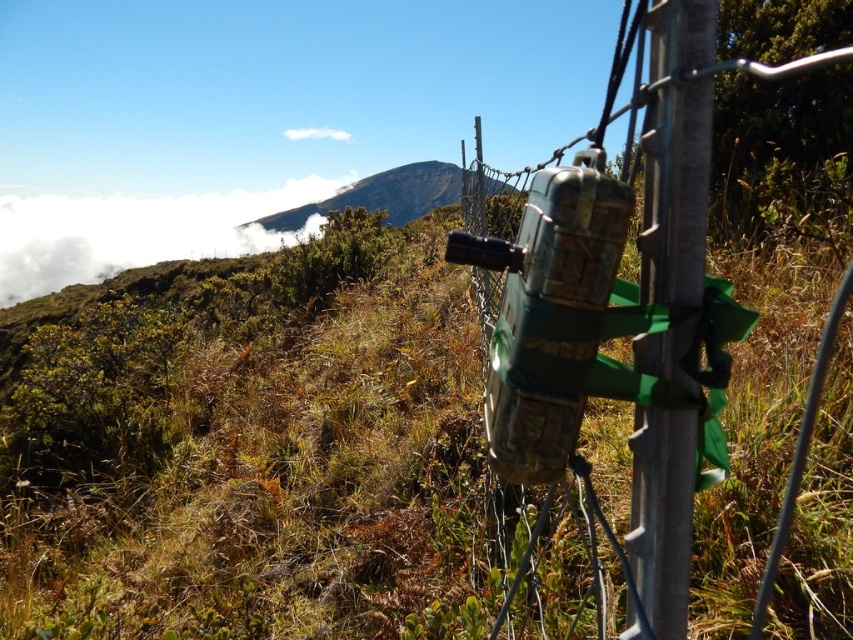
Question: Which point appears farthest from the camera in this image?

Choices:
 (A) (488, 346)
 (B) (660, 573)
 (C) (51, 236)

Answer: (C)

Question: Which object is positioned closest to the metallic chain-link fence at center-right?

Choices:
 (A) metallic pole at right
 (B) white fluffy cloud at upper left

Answer: (A)

Question: Which object is the closest to the white fluffy cloud at upper left?

Choices:
 (A) metallic pole at right
 (B) metallic chain-link fence at center-right

Answer: (A)

Question: Does metallic pole at right appear over white fluffy cloud at upper left?

Choices:
 (A) no
 (B) yes

Answer: (A)

Question: Can you confirm if metallic chain-link fence at center-right is wider than metallic pole at right?

Choices:
 (A) no
 (B) yes

Answer: (B)

Question: Does metallic chain-link fence at center-right have a lesser width compared to white fluffy cloud at upper left?

Choices:
 (A) no
 (B) yes

Answer: (B)